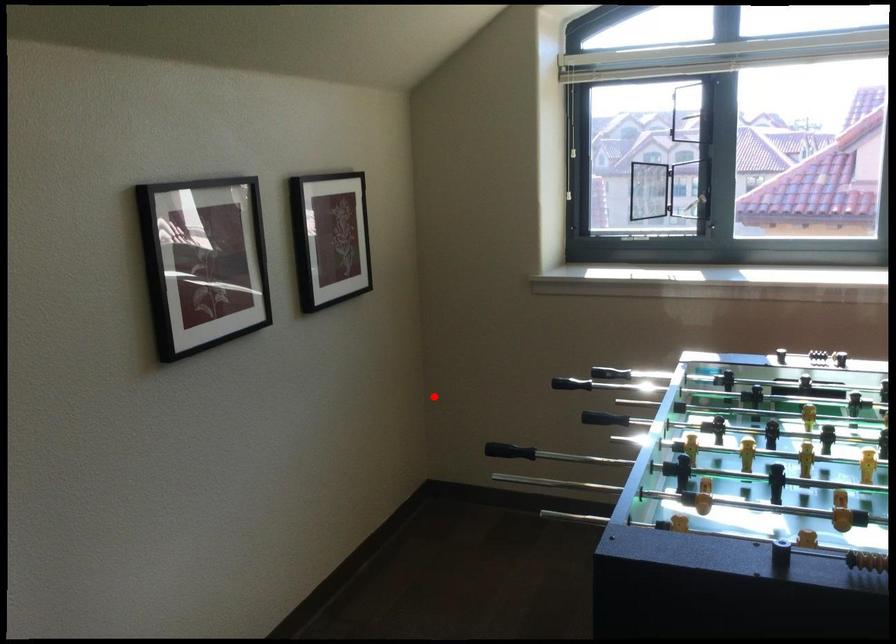
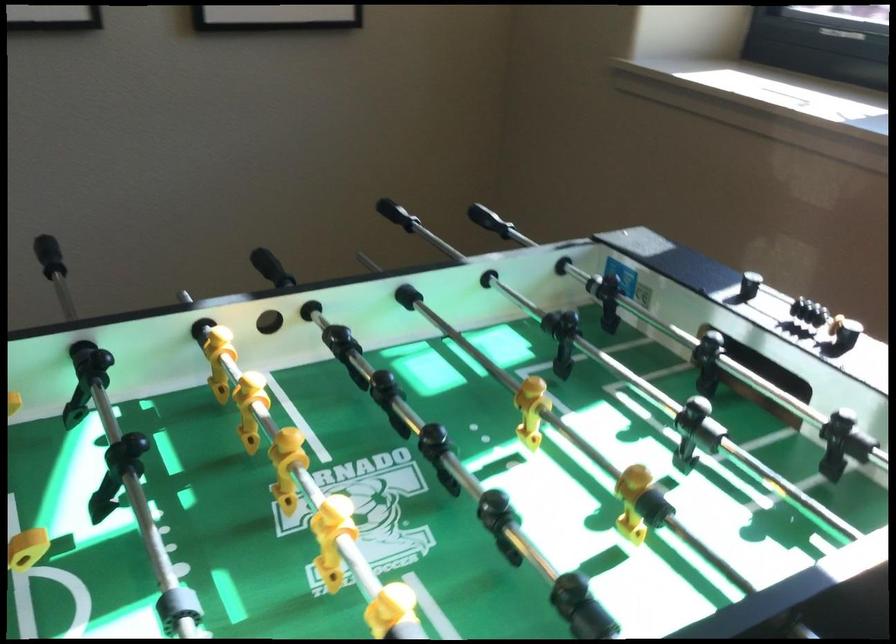
In the second image, find the point that corresponds to the highlighted location in the first image.

(488, 220)